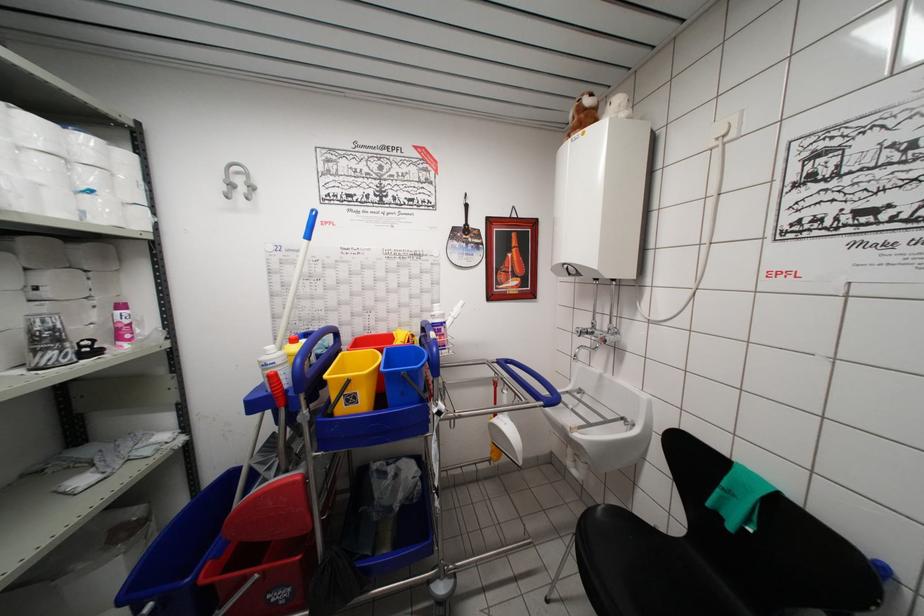
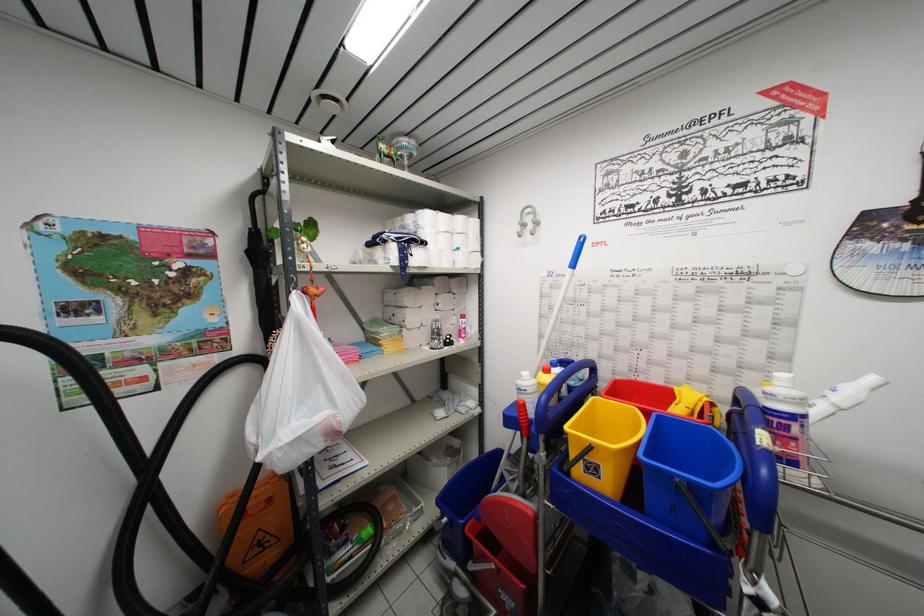
Where in the second image is the point corresponding to point 285,387 from the first image?

(530, 419)